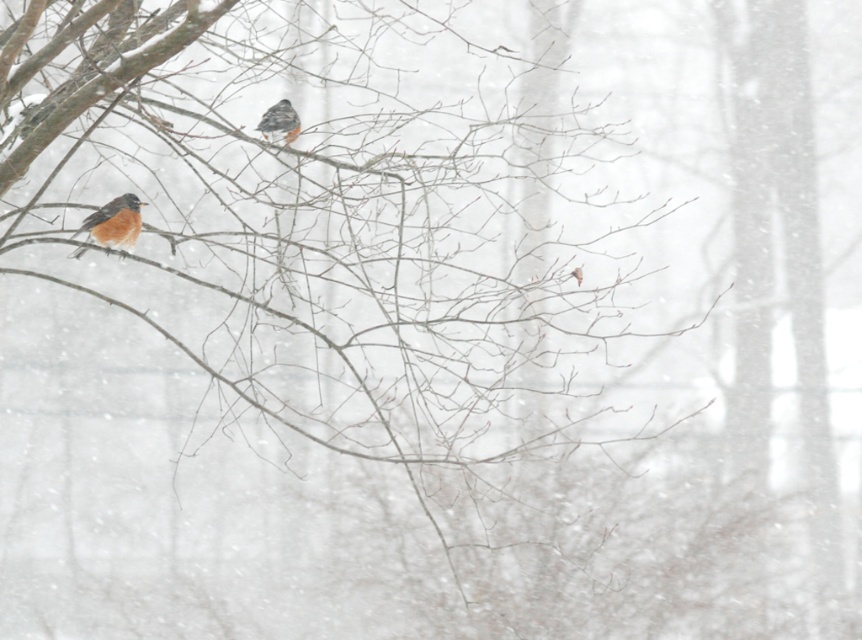
Question: Which point is closer to the camera taking this photo?

Choices:
 (A) (123, 195)
 (B) (269, 113)

Answer: (A)

Question: Is bright orange bird at left to the left of speckled feathered bird at upper center from the viewer's perspective?

Choices:
 (A) no
 (B) yes

Answer: (B)

Question: Which object is farther from the camera taking this photo?

Choices:
 (A) bright orange bird at left
 (B) speckled feathered bird at upper center

Answer: (B)

Question: Is bright orange bird at left below speckled feathered bird at upper center?

Choices:
 (A) yes
 (B) no

Answer: (A)

Question: Can you confirm if bright orange bird at left is positioned to the left of speckled feathered bird at upper center?

Choices:
 (A) yes
 (B) no

Answer: (A)